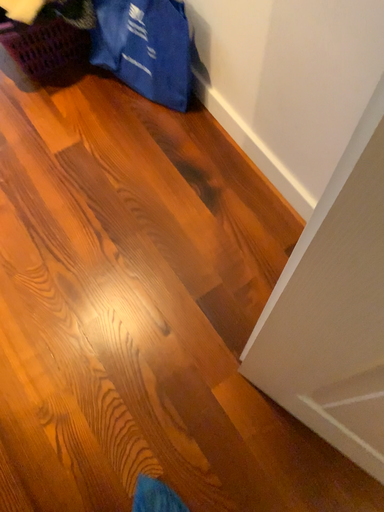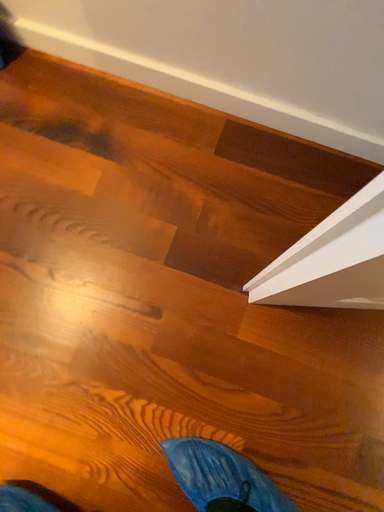
Question: How did the camera likely rotate when shooting the video?

Choices:
 (A) rotated upward
 (B) rotated downward

Answer: (B)